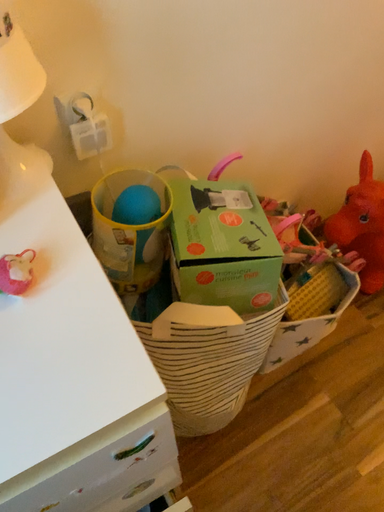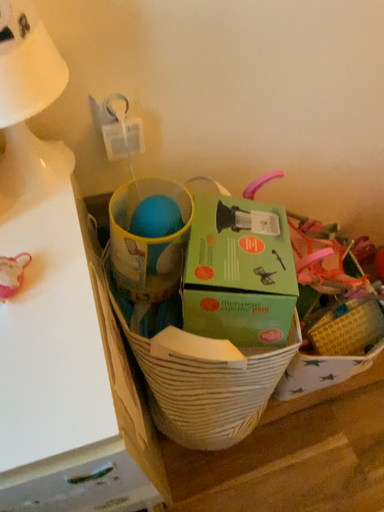
Question: How did the camera likely rotate when shooting the video?

Choices:
 (A) rotated right
 (B) rotated left

Answer: (B)